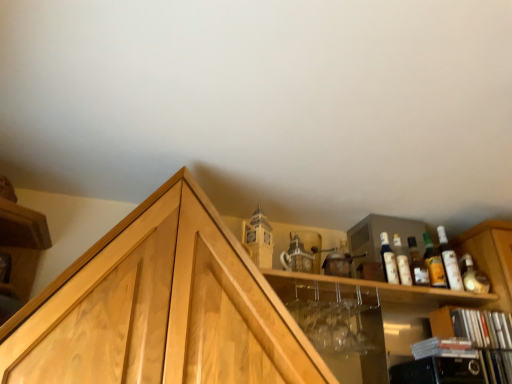
I want to click on translucent glass bottle at upper right, positioned as the second bottle in right-to-left order, so click(x=417, y=265).

This screenshot has width=512, height=384. What do you see at coordinates (417, 265) in the screenshot?
I see `translucent glass bottle at upper right, positioned as the second bottle in right-to-left order` at bounding box center [417, 265].

Describe the element at coordinates (388, 260) in the screenshot. I see `matte glass bottle at upper right, which is counted as the first bottle, starting from the left` at that location.

Where is `wooden cabinet at upper center, placed as the 2th cabinetry when sorted from right to left`? wooden cabinet at upper center, placed as the 2th cabinetry when sorted from right to left is located at coordinates (208, 310).

This screenshot has width=512, height=384. What are the coordinates of `matte glass bottle at upper right, the first bottle viewed from the right` in the screenshot? It's located at pyautogui.click(x=449, y=261).

The height and width of the screenshot is (384, 512). Describe the element at coordinates (480, 337) in the screenshot. I see `black plastic cds at lower right, which ranks as the 1th cabinetry in right-to-left order` at that location.

You are a GUI agent. You are given a task and a screenshot of the screen. Output one action in this format:
    pyautogui.click(x=<x>, y=<y>)
    Task: Click on the translucent glass bottle at upper right, positioned as the second bottle in right-to-left order
    Image resolution: width=512 pixels, height=384 pixels.
    Given the screenshot: What is the action you would take?
    pyautogui.click(x=417, y=265)

Is wooden cabinet at upper center, placed as the 2th cabinetry when sorted from right to left, inside the boundaries of matte glass bottle at upper right, which is the fourth bottle from left to right, or outside?

The correct answer is: outside.

Is wooden cabinet at upper center, placed as the 2th cabinetry when sorted from right to left, thinner than matte glass bottle at upper right, the first bottle viewed from the right?

No, wooden cabinet at upper center, placed as the 2th cabinetry when sorted from right to left, is not thinner than matte glass bottle at upper right, the first bottle viewed from the right.

Between wooden cabinet at upper center, the 1th cabinetry in the left-to-right sequence, and matte glass bottle at upper right, which is the fourth bottle from left to right, which one is positioned behind?

matte glass bottle at upper right, which is the fourth bottle from left to right.

Can you confirm if white glossy bottles at upper right, the third bottle in the right-to-left sequence, is bigger than matte glass bottle at upper right, the first bottle viewed from the right?

Incorrect, white glossy bottles at upper right, the third bottle in the right-to-left sequence, is not larger than matte glass bottle at upper right, the first bottle viewed from the right.

From a real-world perspective, who is located lower, white glossy bottles at upper right, the third bottle in the right-to-left sequence, or matte glass bottle at upper right, which is the fourth bottle from left to right?

white glossy bottles at upper right, the third bottle in the right-to-left sequence, from a real-world perspective.

Between white glossy bottles at upper right, placed as the second bottle when sorted from left to right, and matte glass bottle at upper right, which is the fourth bottle from left to right, which one has smaller width?

white glossy bottles at upper right, placed as the second bottle when sorted from left to right, is thinner.

From the matte orange glass bottle at upper right, count 1st bottles forward and point to it. Please provide its 2D coordinates.

[(402, 262)]

Is matte orange glass bottle at upper right spatially inside white glossy bottles at upper right, the third bottle in the right-to-left sequence, or outside of it?

matte orange glass bottle at upper right is not enclosed by white glossy bottles at upper right, the third bottle in the right-to-left sequence.

From a real-world perspective, is matte orange glass bottle at upper right positioned above or below white glossy bottles at upper right, placed as the second bottle when sorted from left to right?

In terms of real-world spatial position, matte orange glass bottle at upper right is above white glossy bottles at upper right, placed as the second bottle when sorted from left to right.

Who is shorter, matte orange glass bottle at upper right or white glossy bottles at upper right, placed as the second bottle when sorted from left to right?

With less height is white glossy bottles at upper right, placed as the second bottle when sorted from left to right.

Can you confirm if translucent glass bottle at upper right, positioned as the third bottle in left-to-right order, is thinner than matte glass bottle at upper right, which is the fourth bottle from left to right?

Yes, translucent glass bottle at upper right, positioned as the third bottle in left-to-right order, is thinner than matte glass bottle at upper right, which is the fourth bottle from left to right.

Is translucent glass bottle at upper right, positioned as the second bottle in right-to-left order, behind matte glass bottle at upper right, the first bottle viewed from the right?

No.

The height and width of the screenshot is (384, 512). I want to click on bottle that is the 2nd one when counting upward from the matte glass bottle at upper right, the first bottle viewed from the right (from the image's perspective), so click(x=417, y=265).

Which is more to the right, translucent glass bottle at upper right, positioned as the second bottle in right-to-left order, or matte glass bottle at upper right, the 4th bottle from the right?

translucent glass bottle at upper right, positioned as the second bottle in right-to-left order.

This screenshot has width=512, height=384. Find the location of `the 2nd bottle directly above the matte glass bottle at upper right, the 4th bottle from the right (from a real-world perspective)`. the 2nd bottle directly above the matte glass bottle at upper right, the 4th bottle from the right (from a real-world perspective) is located at coordinates (417, 265).

Is the surface of translucent glass bottle at upper right, positioned as the second bottle in right-to-left order, in direct contact with matte glass bottle at upper right, the 4th bottle from the right?

Yes, translucent glass bottle at upper right, positioned as the second bottle in right-to-left order, is touching matte glass bottle at upper right, the 4th bottle from the right.

Between point (421, 267) and point (388, 250), which one is positioned in front?

Positioned in front is point (421, 267).

From a real-world perspective, is translucent glass bottle at upper right, positioned as the second bottle in right-to-left order, positioned under matte orange glass bottle at upper right based on gravity?

Incorrect, from a real-world perspective, translucent glass bottle at upper right, positioned as the second bottle in right-to-left order, is higher than matte orange glass bottle at upper right.

Is translucent glass bottle at upper right, positioned as the second bottle in right-to-left order, aimed at matte orange glass bottle at upper right?

No, translucent glass bottle at upper right, positioned as the second bottle in right-to-left order, is not aimed at matte orange glass bottle at upper right.

From the image's perspective, is translucent glass bottle at upper right, positioned as the second bottle in right-to-left order, under matte orange glass bottle at upper right?

No.

Does matte glass bottle at upper right, the first bottle viewed from the right, have a greater height compared to black plastic cds at lower right, placed as the second cabinetry when sorted from left to right?

Incorrect, the height of matte glass bottle at upper right, the first bottle viewed from the right, is not larger of that of black plastic cds at lower right, placed as the second cabinetry when sorted from left to right.

Is matte glass bottle at upper right, the first bottle viewed from the right, inside the boundaries of black plastic cds at lower right, which ranks as the 1th cabinetry in right-to-left order, or outside?

matte glass bottle at upper right, the first bottle viewed from the right, lies outside black plastic cds at lower right, which ranks as the 1th cabinetry in right-to-left order.

Is black plastic cds at lower right, placed as the second cabinetry when sorted from left to right, at the back of matte glass bottle at upper right, which is the fourth bottle from left to right?

Answer: That's not correct — matte glass bottle at upper right, which is the fourth bottle from left to right, is not looking away from black plastic cds at lower right, placed as the second cabinetry when sorted from left to right.

Is point (454, 281) more distant than point (445, 320)?

Yes, it is.

This screenshot has height=384, width=512. Identify the location of the 4th bottle to the right of the wooden cabinet at upper center, placed as the 2th cabinetry when sorted from right to left, starting your count from the anchor. (449, 261).

You are a GUI agent. You are given a task and a screenshot of the screen. Output one action in this format:
    pyautogui.click(x=<x>, y=<y>)
    Task: Click on the 1st bottle in front of the matte glass bottle at upper right, which is the fourth bottle from left to right, starting your count from the anchor
    
    Given the screenshot: What is the action you would take?
    pyautogui.click(x=402, y=262)

Looking at the image, which one is located closer to black plastic cds at lower right, which ranks as the 1th cabinetry in right-to-left order, white glossy bottles at upper right, placed as the second bottle when sorted from left to right, or wooden cabinet at upper center, the 1th cabinetry in the left-to-right sequence?

white glossy bottles at upper right, placed as the second bottle when sorted from left to right, is closer to black plastic cds at lower right, which ranks as the 1th cabinetry in right-to-left order.

Considering their positions, is black plastic cds at lower right, which ranks as the 1th cabinetry in right-to-left order, positioned closer to matte glass bottle at upper right, the 4th bottle from the right, than matte orange glass bottle at upper right?

Based on the image, matte orange glass bottle at upper right appears to be nearer to matte glass bottle at upper right, the 4th bottle from the right.

When comparing their distances from wooden cabinet at upper center, the 1th cabinetry in the left-to-right sequence, does matte glass bottle at upper right, which is the fourth bottle from left to right, or translucent glass bottle at upper right, positioned as the second bottle in right-to-left order, seem closer?

Based on the image, translucent glass bottle at upper right, positioned as the second bottle in right-to-left order, appears to be nearer to wooden cabinet at upper center, the 1th cabinetry in the left-to-right sequence.

Estimate the real-world distances between objects in this image. Which object is further from wooden cabinet at upper center, placed as the 2th cabinetry when sorted from right to left, white glossy bottles at upper right, placed as the second bottle when sorted from left to right, or matte glass bottle at upper right, which is the fourth bottle from left to right?

matte glass bottle at upper right, which is the fourth bottle from left to right, is positioned further to the anchor wooden cabinet at upper center, placed as the 2th cabinetry when sorted from right to left.

Estimate the real-world distances between objects in this image. Which object is further from matte glass bottle at upper right, the first bottle viewed from the right, translucent glass bottle at upper right, positioned as the third bottle in left-to-right order, or white glossy bottles at upper right, placed as the second bottle when sorted from left to right?

Based on the image, white glossy bottles at upper right, placed as the second bottle when sorted from left to right, appears to be further to matte glass bottle at upper right, the first bottle viewed from the right.

Which object lies further to the anchor point white glossy bottles at upper right, the third bottle in the right-to-left sequence, black plastic cds at lower right, which ranks as the 1th cabinetry in right-to-left order, or wooden cabinet at upper center, the 1th cabinetry in the left-to-right sequence?

wooden cabinet at upper center, the 1th cabinetry in the left-to-right sequence.

Considering their positions, is matte glass bottle at upper right, the 4th bottle from the right, positioned further to matte orange glass bottle at upper right than wooden cabinet at upper center, the 1th cabinetry in the left-to-right sequence?

The object further to matte orange glass bottle at upper right is wooden cabinet at upper center, the 1th cabinetry in the left-to-right sequence.

When comparing their distances from matte glass bottle at upper right, the first bottle viewed from the right, does white glossy bottles at upper right, the third bottle in the right-to-left sequence, or wooden cabinet at upper center, placed as the 2th cabinetry when sorted from right to left, seem closer?

Among the two, white glossy bottles at upper right, the third bottle in the right-to-left sequence, is located nearer to matte glass bottle at upper right, the first bottle viewed from the right.

Identify the location of bottle between white glossy bottles at upper right, placed as the second bottle when sorted from left to right, and matte glass bottle at upper right, which is the fourth bottle from left to right, in the horizontal direction. (417, 265).

Identify the location of beer bottle between white glossy bottles at upper right, the third bottle in the right-to-left sequence, and black plastic cds at lower right, placed as the second cabinetry when sorted from left to right, from top to bottom. The width and height of the screenshot is (512, 384). (434, 263).

I want to click on beer bottle between translucent glass bottle at upper right, positioned as the second bottle in right-to-left order, and matte glass bottle at upper right, the first bottle viewed from the right, in the horizontal direction, so click(434, 263).

You are a GUI agent. You are given a task and a screenshot of the screen. Output one action in this format:
    pyautogui.click(x=<x>, y=<y>)
    Task: Click on the beer bottle situated between wooden cabinet at upper center, placed as the 2th cabinetry when sorted from right to left, and black plastic cds at lower right, placed as the second cabinetry when sorted from left to right, from left to right
    
    Given the screenshot: What is the action you would take?
    coord(434,263)